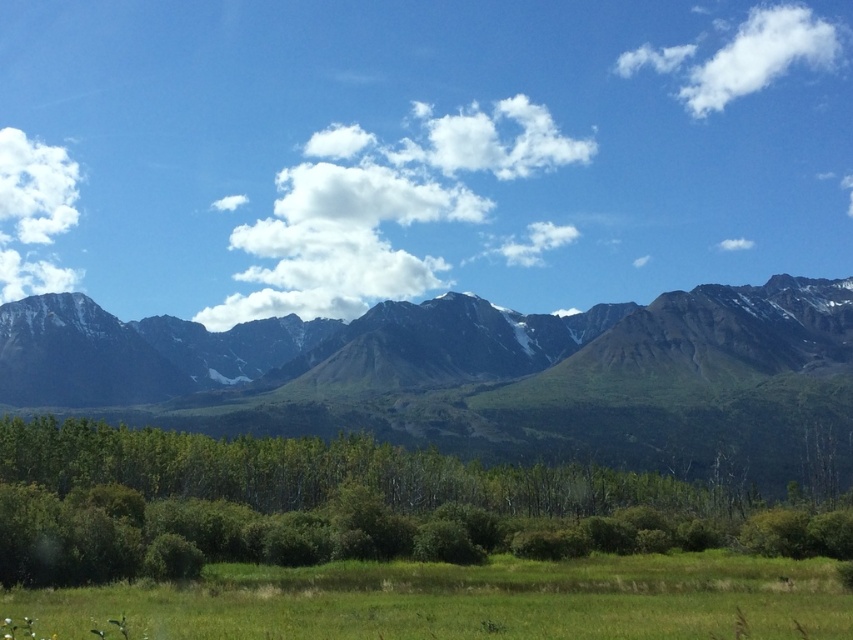
Based on the photo, you are an airplane pilot flying at an altitude of 10,000 feet. You notice two white fluffy clouds in the sky ahead of you. The first is the white fluffy cloud at center, and the second is the white fluffy cloud at upper left. Which cloud would you need to ascend higher to avoid?

The white fluffy cloud at center is much taller than the white fluffy cloud at upper left, so you should ascend higher to avoid the white fluffy cloud at center.